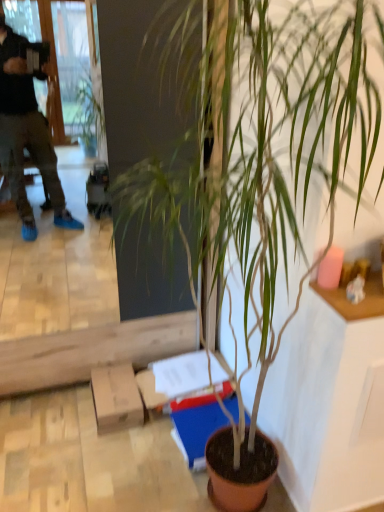
The width and height of the screenshot is (384, 512). Describe the element at coordinates (116, 398) in the screenshot. I see `brown cardboard box at lower center` at that location.

The height and width of the screenshot is (512, 384). What are the coordinates of `brown cardboard box at lower center` in the screenshot? It's located at (116, 398).

The width and height of the screenshot is (384, 512). In order to click on brown cardboard box at lower center in this screenshot , I will do `click(116, 398)`.